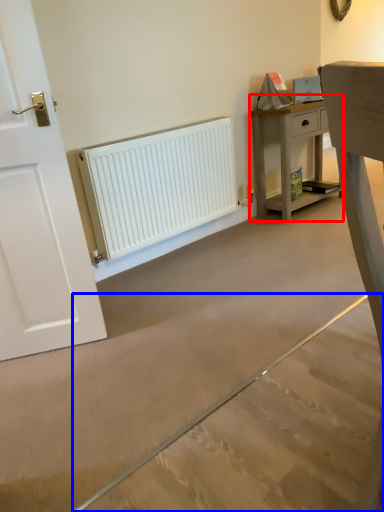
Question: Which of the following is the farthest to the observer, nightstand (highlighted by a red box) or concrete (highlighted by a blue box)?

Choices:
 (A) nightstand
 (B) concrete

Answer: (A)